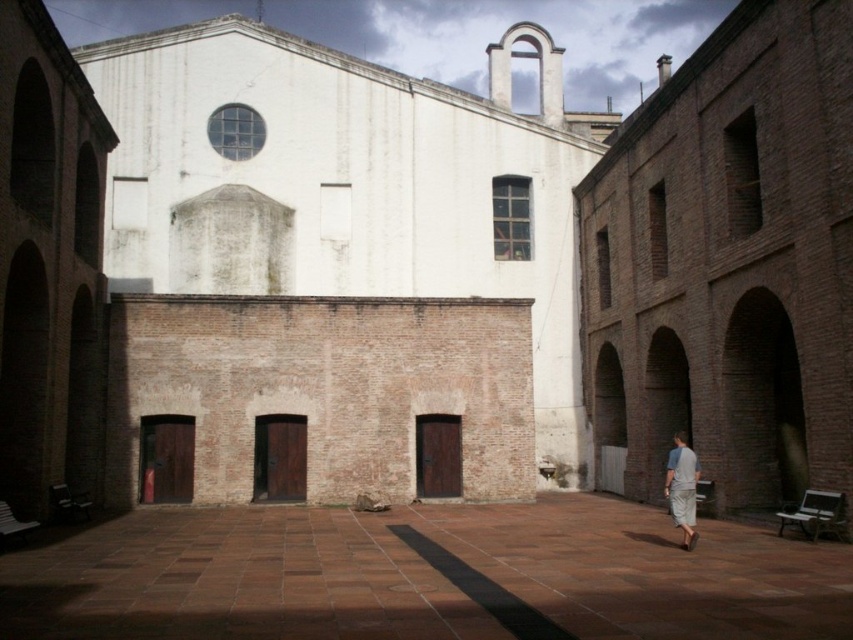
You are standing in the courtyard and notice the brown brick church at right and the gray cotton shirt at lower right. Which object is positioned higher from the ground?

The brown brick church at right is above the gray cotton shirt at lower right, so it is positioned higher from the ground.

You are standing in the courtyard and want to take a photo of the brown brick church at right and the gray cotton shirt at lower right. Which object should you zoom in more on to capture both in the frame without cropping?

You should zoom in more on the gray cotton shirt at lower right because the brown brick church at right is larger, so focusing on the smaller object allows both to fit in the frame.

You are standing in the courtyard and want to take a photo of the brown brick church at right. If your camera has a zoom lens that can focus precisely on objects located at coordinates between 0.4 and 0.9 on the horizontal axis, will you need to adjust your position to ensure it is in frame?

The brown brick church at right is located at point 0.411 on the horizontal axis, which falls within the camera lens range of 0.4 to 0.9. Therefore, you do not need to adjust your position to keep it in frame.